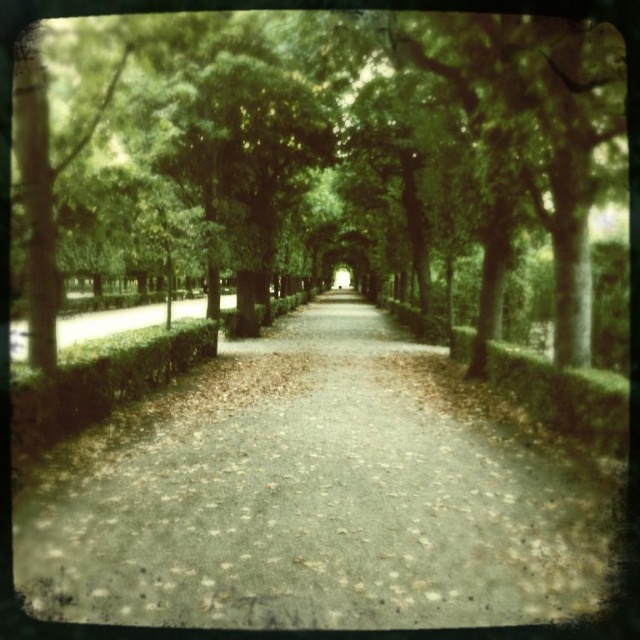
You are a hiker standing at the entrance of the pathway. You want to take a photo of the green leafy tree at center and the dull gray concrete path at center. Which object will appear larger in the photo?

The green leafy tree at center will appear larger in the photo because it is taller than the dull gray concrete path at center.

You are standing at the point marked as point [349,148] in the image. What object are you currently standing on?

You are standing on the green leafy tree at center.

You are planning to take a walk along the dull gray concrete path at center and want to ensure there is enough space to walk comfortably. Considering the green leafy tree at center, which is larger, will it obstruct your path?

The green leafy tree at center has a larger size compared to the dull gray concrete path at center, so it may obstruct the path. You should be cautious while walking to avoid the tree branches or consider an alternative route.